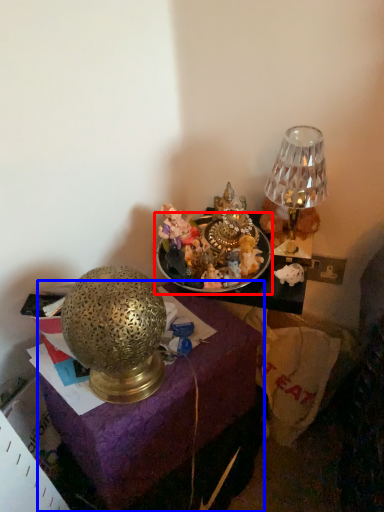
Question: Which point is further to the camera, tableware (highlighted by a red box) or furniture (highlighted by a blue box)?

Choices:
 (A) tableware
 (B) furniture

Answer: (A)